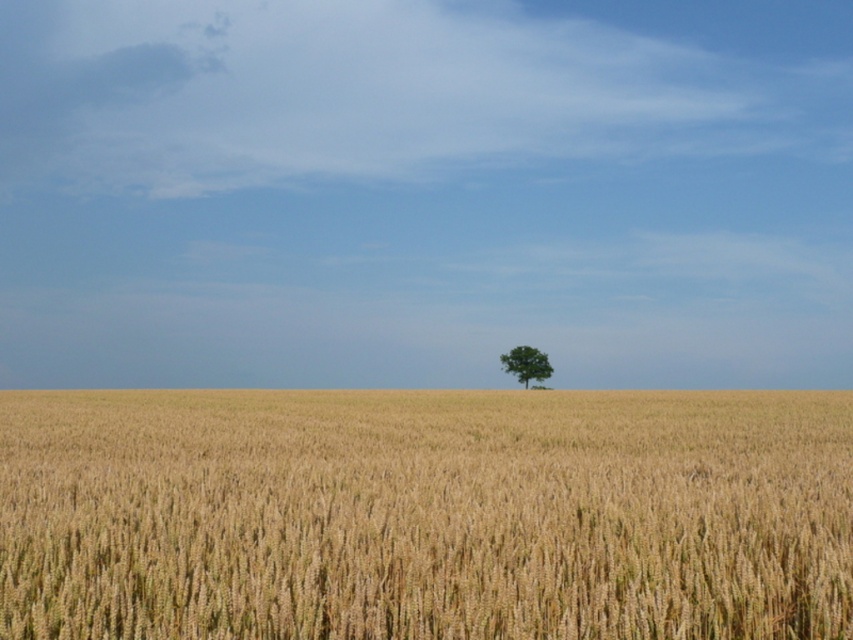
Can you confirm if golden wheat field at center is positioned to the left of green matte tree at center?

Correct, you'll find golden wheat field at center to the left of green matte tree at center.

Which is more to the left, golden wheat field at center or green matte tree at center?

golden wheat field at center

The height and width of the screenshot is (640, 853). Find the location of `golden wheat field at center`. golden wheat field at center is located at coordinates (425, 515).

Find the location of a particular element. The height and width of the screenshot is (640, 853). golden wheat field at center is located at coordinates (425, 515).